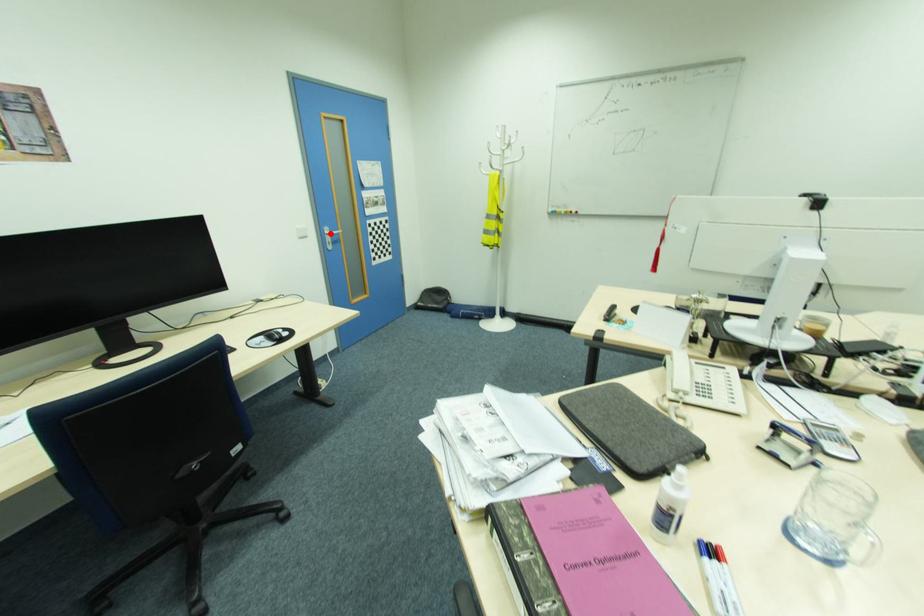
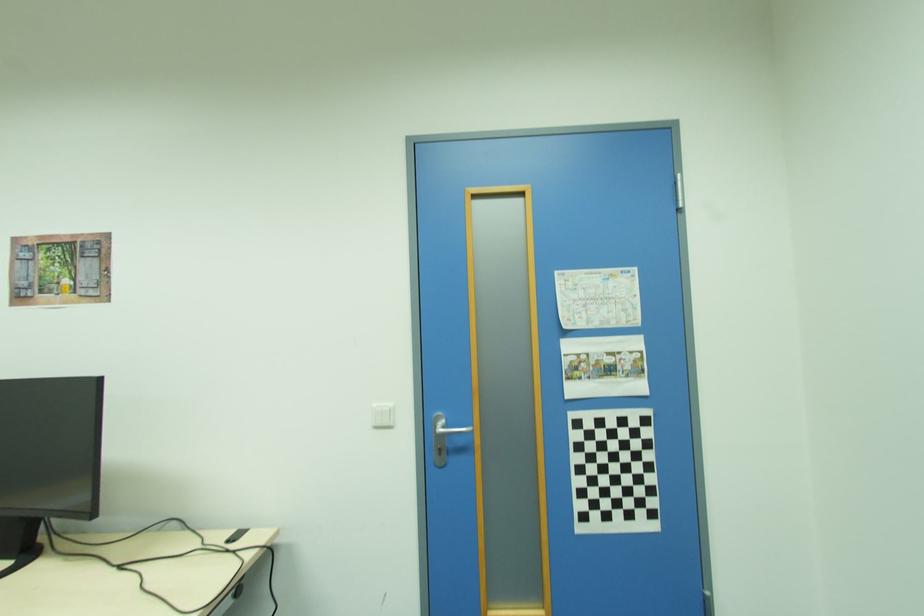
Question: I am providing you with two images of the same scene from different viewpoints. Image1 has a red point marked. In image2, the corresponding 3D location appears at what relative position? Reply with the corresponding letter.

Choices:
 (A) Closer
 (B) Farther

Answer: (B)